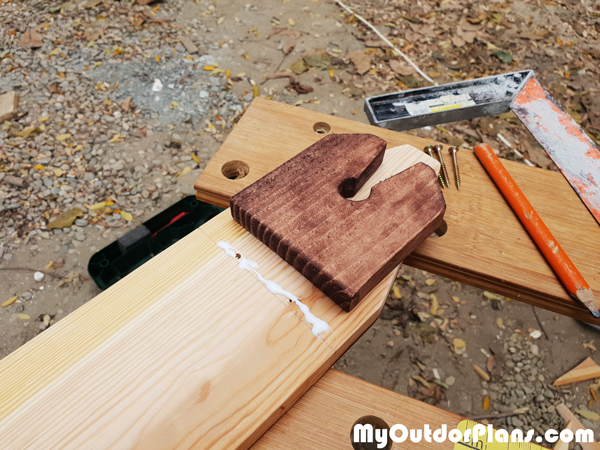
This screenshot has width=600, height=450. I want to click on white extension cord, so click(383, 36).